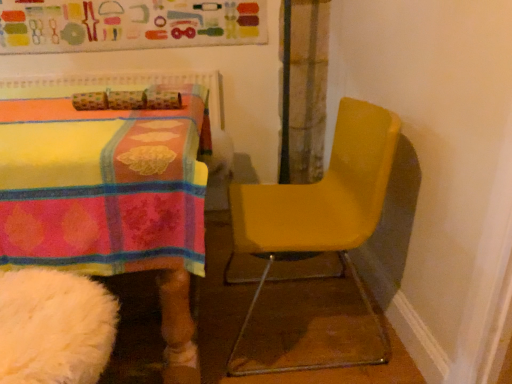
This screenshot has height=384, width=512. What do you see at coordinates (316, 252) in the screenshot?
I see `yellow matte chair at right` at bounding box center [316, 252].

The height and width of the screenshot is (384, 512). In order to click on yellow matte chair at right in this screenshot , I will do `click(316, 252)`.

The height and width of the screenshot is (384, 512). What do you see at coordinates (128, 24) in the screenshot? I see `matte fabric bulletin board at upper center` at bounding box center [128, 24].

Image resolution: width=512 pixels, height=384 pixels. I want to click on matte fabric bulletin board at upper center, so click(128, 24).

This screenshot has height=384, width=512. What are the coordinates of `yellow matte chair at right` in the screenshot? It's located at (316, 252).

Does matte fabric bulletin board at upper center appear on the left side of yellow matte chair at right?

Yes, matte fabric bulletin board at upper center is to the left of yellow matte chair at right.

Which object is closer to the camera taking this photo, matte fabric bulletin board at upper center or yellow matte chair at right?

yellow matte chair at right is more forward.

Between point (238, 38) and point (388, 134), which one is positioned in front?

The point (388, 134) is more forward.

From the image's perspective, is matte fabric bulletin board at upper center positioned above or below yellow matte chair at right?

matte fabric bulletin board at upper center is situated higher than yellow matte chair at right in the image.

From a real-world perspective, is matte fabric bulletin board at upper center above or below yellow matte chair at right?

matte fabric bulletin board at upper center is situated higher than yellow matte chair at right in the real world.

Which of these two, matte fabric bulletin board at upper center or yellow matte chair at right, is wider?

Wider between the two is yellow matte chair at right.

Looking at this image, who is taller, matte fabric bulletin board at upper center or yellow matte chair at right?

Standing taller between the two is yellow matte chair at right.

Consider the image. Can you confirm if matte fabric bulletin board at upper center is bigger than yellow matte chair at right?

Actually, matte fabric bulletin board at upper center might be smaller than yellow matte chair at right.

Is matte fabric bulletin board at upper center situated inside yellow matte chair at right or outside?

matte fabric bulletin board at upper center is not enclosed by yellow matte chair at right.

Is matte fabric bulletin board at upper center far from yellow matte chair at right?

Absolutely, matte fabric bulletin board at upper center is distant from yellow matte chair at right.

Looking at this image, is matte fabric bulletin board at upper center facing towards yellow matte chair at right?

A: No, matte fabric bulletin board at upper center is not facing towards yellow matte chair at right.

How many degrees apart are the facing directions of matte fabric bulletin board at upper center and yellow matte chair at right?

There is a 90.1-degree angle between the facing directions of matte fabric bulletin board at upper center and yellow matte chair at right.

At what (x,y) coordinates should I click in order to perform the action: click on bulletin board above the yellow matte chair at right (from the image's perspective). Please return your answer as a coordinate pair (x, y). Looking at the image, I should click on (128, 24).

Considering the relative positions of yellow matte chair at right and matte fabric bulletin board at upper center in the image provided, is yellow matte chair at right to the left of matte fabric bulletin board at upper center from the viewer's perspective?

No, yellow matte chair at right is not to the left of matte fabric bulletin board at upper center.

Who is more distant, yellow matte chair at right or matte fabric bulletin board at upper center?

matte fabric bulletin board at upper center.

Is point (263, 201) closer or farther from the camera than point (193, 13)?

Point (263, 201).

From the image's perspective, would you say yellow matte chair at right is shown under matte fabric bulletin board at upper center?

Correct, yellow matte chair at right appears lower than matte fabric bulletin board at upper center in the image.

From a real-world perspective, is yellow matte chair at right above or below matte fabric bulletin board at upper center?

In terms of real-world spatial position, yellow matte chair at right is below matte fabric bulletin board at upper center.

Is yellow matte chair at right wider than matte fabric bulletin board at upper center?

Indeed, yellow matte chair at right has a greater width compared to matte fabric bulletin board at upper center.

Who is taller, yellow matte chair at right or matte fabric bulletin board at upper center?

yellow matte chair at right is taller.

Considering the relative sizes of yellow matte chair at right and matte fabric bulletin board at upper center in the image provided, is yellow matte chair at right smaller than matte fabric bulletin board at upper center?

No, yellow matte chair at right is not smaller than matte fabric bulletin board at upper center.

Is yellow matte chair at right inside the boundaries of matte fabric bulletin board at upper center, or outside?

yellow matte chair at right lies outside matte fabric bulletin board at upper center.

Is yellow matte chair at right positioned far away from matte fabric bulletin board at upper center?

That's right, there is a large distance between yellow matte chair at right and matte fabric bulletin board at upper center.

Could you tell me if yellow matte chair at right is turned towards matte fabric bulletin board at upper center?

No, yellow matte chair at right is not facing towards matte fabric bulletin board at upper center.

Can you tell me how much yellow matte chair at right and matte fabric bulletin board at upper center differ in facing direction?

The facing directions of yellow matte chair at right and matte fabric bulletin board at upper center are 90.1 degrees apart.

In the image, there is a yellow matte chair at right. Where is `bulletin board above it (from the image's perspective)`? bulletin board above it (from the image's perspective) is located at coordinates (128, 24).

This screenshot has width=512, height=384. Find the location of `chair on the right of matte fabric bulletin board at upper center`. chair on the right of matte fabric bulletin board at upper center is located at coordinates (316, 252).

Identify the location of bulletin board that is above the yellow matte chair at right (from a real-world perspective). This screenshot has height=384, width=512. (128, 24).